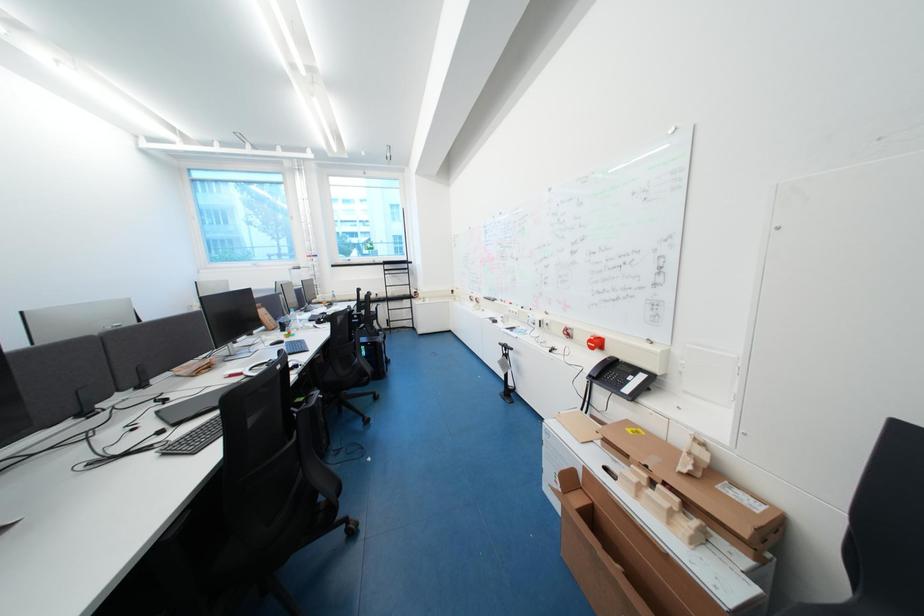
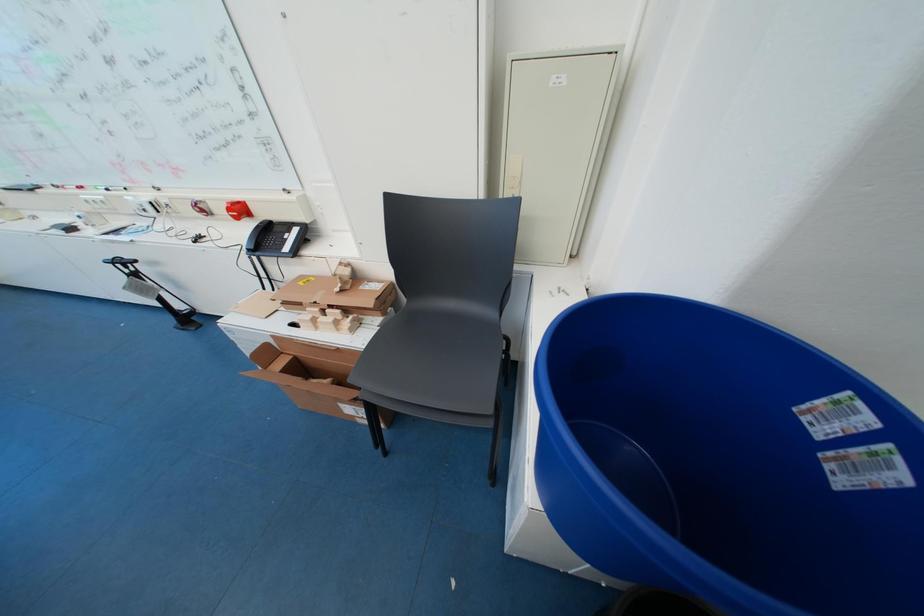
Based on the continuous images, in which direction is the camera rotating?

The camera rotated toward right-down.